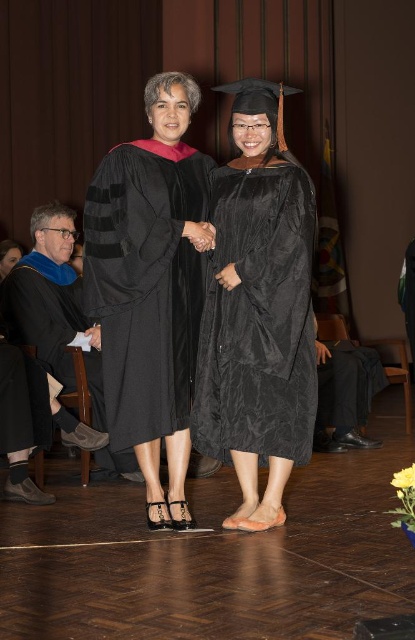
Question: Among these objects, which one is farthest from the camera?

Choices:
 (A) matte black robe at left
 (B) matte black gown at center
 (C) matte black graduation gown at center

Answer: (A)

Question: Estimate the real-world distances between objects in this image. Which object is farther from the matte black robe at left?

Choices:
 (A) matte black graduation gown at center
 (B) matte black gown at center

Answer: (A)

Question: Is matte black gown at center below matte black robe at left?

Choices:
 (A) yes
 (B) no

Answer: (B)

Question: Which point is closer to the camera?

Choices:
 (A) matte black robe at left
 (B) matte black graduation gown at center
 (C) matte black gown at center

Answer: (B)

Question: Can you confirm if matte black graduation gown at center is thinner than matte black gown at center?

Choices:
 (A) no
 (B) yes

Answer: (B)

Question: Does matte black graduation gown at center appear under matte black robe at left?

Choices:
 (A) no
 (B) yes

Answer: (A)